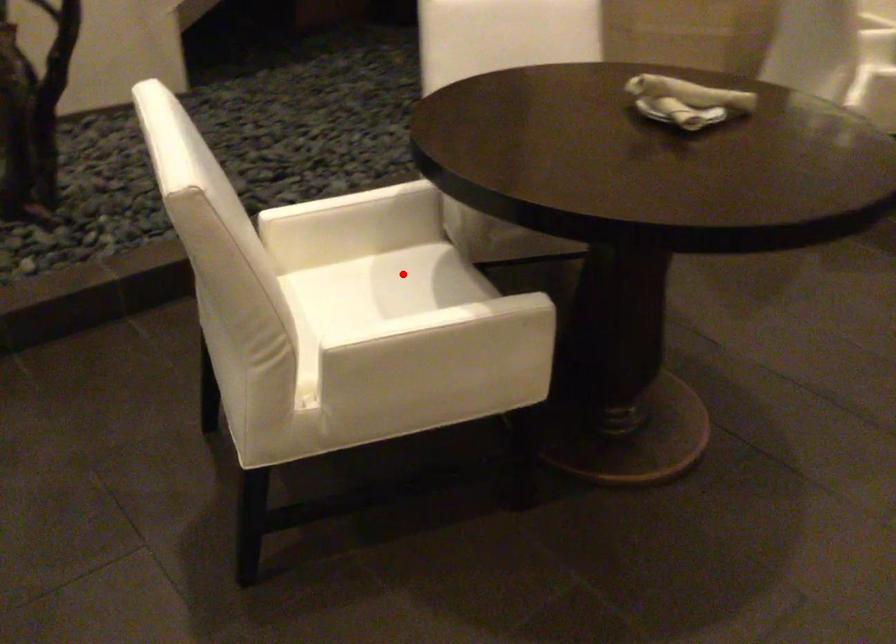
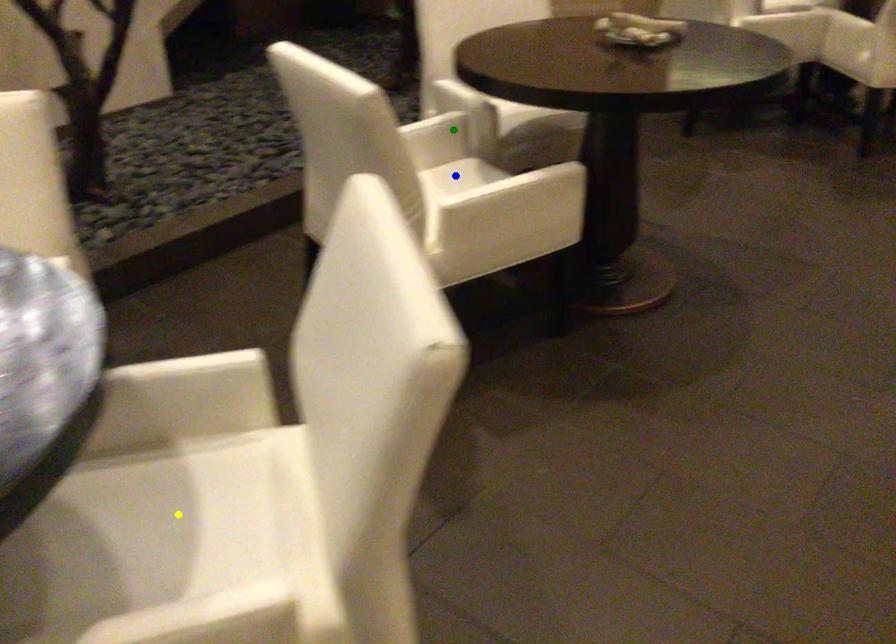
Question: I am providing you with two images of the same scene from different viewpoints. A red point is marked on the first image. You are given multiple points on the second image. Which spot in image 2 lines up with the point in image 1?

Choices:
 (A) green point
 (B) blue point
 (C) yellow point

Answer: (B)